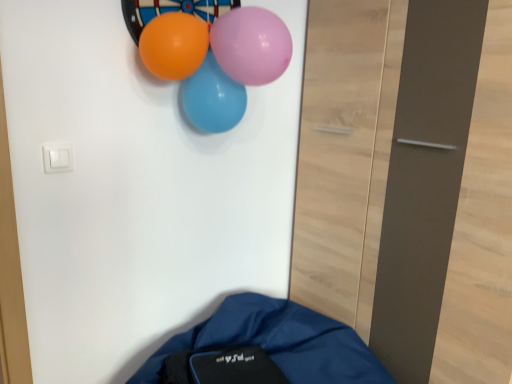
Describe the element at coordinates (251, 45) in the screenshot. I see `purple glossy balloon at upper center, which is the 3th balloon in back-to-front order` at that location.

Image resolution: width=512 pixels, height=384 pixels. I want to click on orange glossy balloon at upper center, arranged as the 2th balloon when viewed from the front, so click(174, 45).

From the picture: From a real-world perspective, relative to orange glossy balloon at upper center, the 2th balloon positioned from the back, is purple glossy balloon at upper center, which is the 3th balloon in back-to-front order, vertically above or below?

From a real-world perspective, purple glossy balloon at upper center, which is the 3th balloon in back-to-front order, is physically above orange glossy balloon at upper center, the 2th balloon positioned from the back.

The width and height of the screenshot is (512, 384). Find the location of `balloon above the orange glossy balloon at upper center, the 2th balloon positioned from the back (from the image's perspective)`. balloon above the orange glossy balloon at upper center, the 2th balloon positioned from the back (from the image's perspective) is located at coordinates (251, 45).

Considering the relative sizes of purple glossy balloon at upper center, which is the 3th balloon in back-to-front order, and orange glossy balloon at upper center, arranged as the 2th balloon when viewed from the front, in the image provided, is purple glossy balloon at upper center, which is the 3th balloon in back-to-front order, bigger than orange glossy balloon at upper center, arranged as the 2th balloon when viewed from the front,?

Correct, purple glossy balloon at upper center, which is the 3th balloon in back-to-front order, is larger in size than orange glossy balloon at upper center, arranged as the 2th balloon when viewed from the front.

From the image's perspective, would you say purple glossy balloon at upper center, placed as the first balloon when sorted from front to back, is shown under orange glossy balloon at upper center, the 2th balloon positioned from the back?

No, from the image's perspective, purple glossy balloon at upper center, placed as the first balloon when sorted from front to back, is not below orange glossy balloon at upper center, the 2th balloon positioned from the back.

Considering the sizes of objects purple glossy balloon at upper center, placed as the first balloon when sorted from front to back, and blue glossy balloon at upper center, arranged as the 1th balloon when viewed from the back, in the image provided, who is smaller, purple glossy balloon at upper center, placed as the first balloon when sorted from front to back, or blue glossy balloon at upper center, arranged as the 1th balloon when viewed from the back,?

purple glossy balloon at upper center, placed as the first balloon when sorted from front to back, is smaller.

Is point (233, 47) positioned after point (238, 102)?

No, (233, 47) is closer to viewer.

Is purple glossy balloon at upper center, which is the 3th balloon in back-to-front order, in front of blue glossy balloon at upper center, the third balloon from the front?

Yes, purple glossy balloon at upper center, which is the 3th balloon in back-to-front order, is closer to the viewer.

Is purple glossy balloon at upper center, placed as the first balloon when sorted from front to back, surrounding blue glossy balloon at upper center, the third balloon from the front?

No, blue glossy balloon at upper center, the third balloon from the front, is not a part of purple glossy balloon at upper center, placed as the first balloon when sorted from front to back.

Find the location of a particular element. balloon that is the 1st one when counting downward from the purple glossy balloon at upper center, which is the 3th balloon in back-to-front order (from the image's perspective) is located at coordinates (174, 45).

Is orange glossy balloon at upper center, the 2th balloon positioned from the back, facing away from purple glossy balloon at upper center, placed as the first balloon when sorted from front to back?

No.

From a real-world perspective, is orange glossy balloon at upper center, arranged as the 2th balloon when viewed from the front, above or below purple glossy balloon at upper center, placed as the first balloon when sorted from front to back?

Clearly, from a real-world perspective, orange glossy balloon at upper center, arranged as the 2th balloon when viewed from the front, is below purple glossy balloon at upper center, placed as the first balloon when sorted from front to back.

Which object is closer to the camera, orange glossy balloon at upper center, the 2th balloon positioned from the back, or purple glossy balloon at upper center, placed as the first balloon when sorted from front to back?

Positioned in front is purple glossy balloon at upper center, placed as the first balloon when sorted from front to back.

Is the depth of blue glossy balloon at upper center, the third balloon from the front, greater than that of orange glossy balloon at upper center, the 2th balloon positioned from the back?

Yes, it is behind orange glossy balloon at upper center, the 2th balloon positioned from the back.

At what (x,y) coordinates should I click in order to perform the action: click on the 1st balloon in front of the blue glossy balloon at upper center, the third balloon from the front. Please return your answer as a coordinate pair (x, y). This screenshot has width=512, height=384. Looking at the image, I should click on (174, 45).

Is blue glossy balloon at upper center, arranged as the 1th balloon when viewed from the back, to the left or to the right of orange glossy balloon at upper center, arranged as the 2th balloon when viewed from the front, in the image?

blue glossy balloon at upper center, arranged as the 1th balloon when viewed from the back, is to the right of orange glossy balloon at upper center, arranged as the 2th balloon when viewed from the front.

Are blue glossy balloon at upper center, the third balloon from the front, and orange glossy balloon at upper center, arranged as the 2th balloon when viewed from the front, far apart?

No, blue glossy balloon at upper center, the third balloon from the front, is in close proximity to orange glossy balloon at upper center, arranged as the 2th balloon when viewed from the front.

From a real-world perspective, is orange glossy balloon at upper center, the 2th balloon positioned from the back, below blue glossy balloon at upper center, arranged as the 1th balloon when viewed from the back?

No.

Between orange glossy balloon at upper center, arranged as the 2th balloon when viewed from the front, and blue glossy balloon at upper center, the third balloon from the front, which one has larger width?

Wider between the two is orange glossy balloon at upper center, arranged as the 2th balloon when viewed from the front.

What's the angular difference between orange glossy balloon at upper center, the 2th balloon positioned from the back, and blue glossy balloon at upper center, the third balloon from the front,'s facing directions?

The facing directions of orange glossy balloon at upper center, the 2th balloon positioned from the back, and blue glossy balloon at upper center, the third balloon from the front, are 0.000221 degrees apart.

Is orange glossy balloon at upper center, arranged as the 2th balloon when viewed from the front, outside of blue glossy balloon at upper center, the third balloon from the front?

Yes, orange glossy balloon at upper center, arranged as the 2th balloon when viewed from the front, is located beyond the bounds of blue glossy balloon at upper center, the third balloon from the front.

Does blue glossy balloon at upper center, the third balloon from the front, have a larger size compared to purple glossy balloon at upper center, placed as the first balloon when sorted from front to back?

Indeed, blue glossy balloon at upper center, the third balloon from the front, has a larger size compared to purple glossy balloon at upper center, placed as the first balloon when sorted from front to back.

Considering the positions of objects blue glossy balloon at upper center, the third balloon from the front, and purple glossy balloon at upper center, placed as the first balloon when sorted from front to back, in the image provided, who is in front, blue glossy balloon at upper center, the third balloon from the front, or purple glossy balloon at upper center, placed as the first balloon when sorted from front to back,?

purple glossy balloon at upper center, placed as the first balloon when sorted from front to back.

From the picture: Could you tell me if blue glossy balloon at upper center, the third balloon from the front, is facing purple glossy balloon at upper center, which is the 3th balloon in back-to-front order?

Yes, blue glossy balloon at upper center, the third balloon from the front, is turned towards purple glossy balloon at upper center, which is the 3th balloon in back-to-front order.

Does blue glossy balloon at upper center, the third balloon from the front, touch purple glossy balloon at upper center, which is the 3th balloon in back-to-front order?

blue glossy balloon at upper center, the third balloon from the front, is not next to purple glossy balloon at upper center, which is the 3th balloon in back-to-front order, and they're not touching.

Starting from the orange glossy balloon at upper center, the 2th balloon positioned from the back, which balloon is the 2nd one to the right? Please provide its 2D coordinates.

[(251, 45)]

Starting from the purple glossy balloon at upper center, placed as the first balloon when sorted from front to back, which balloon is the 2nd one behind? Please provide its 2D coordinates.

[(212, 98)]

Which object lies further to the anchor point blue glossy balloon at upper center, arranged as the 1th balloon when viewed from the back, orange glossy balloon at upper center, arranged as the 2th balloon when viewed from the front, or purple glossy balloon at upper center, placed as the first balloon when sorted from front to back?

Among the two, purple glossy balloon at upper center, placed as the first balloon when sorted from front to back, is located further to blue glossy balloon at upper center, arranged as the 1th balloon when viewed from the back.

In the scene shown: Looking at the image, which one is located further to purple glossy balloon at upper center, placed as the first balloon when sorted from front to back, blue glossy balloon at upper center, the third balloon from the front, or orange glossy balloon at upper center, the 2th balloon positioned from the back?

blue glossy balloon at upper center, the third balloon from the front, is further to purple glossy balloon at upper center, placed as the first balloon when sorted from front to back.

Consider the image. Estimate the real-world distances between objects in this image. Which object is further from orange glossy balloon at upper center, arranged as the 2th balloon when viewed from the front, purple glossy balloon at upper center, which is the 3th balloon in back-to-front order, or blue glossy balloon at upper center, the third balloon from the front?

purple glossy balloon at upper center, which is the 3th balloon in back-to-front order, is positioned further to the anchor orange glossy balloon at upper center, arranged as the 2th balloon when viewed from the front.

Looking at the image, which one is located further to purple glossy balloon at upper center, placed as the first balloon when sorted from front to back, orange glossy balloon at upper center, arranged as the 2th balloon when viewed from the front, or blue glossy balloon at upper center, the third balloon from the front?

Based on the image, blue glossy balloon at upper center, the third balloon from the front, appears to be further to purple glossy balloon at upper center, placed as the first balloon when sorted from front to back.

Which object lies further to the anchor point orange glossy balloon at upper center, the 2th balloon positioned from the back, blue glossy balloon at upper center, the third balloon from the front, or purple glossy balloon at upper center, which is the 3th balloon in back-to-front order?

The object further to orange glossy balloon at upper center, the 2th balloon positioned from the back, is purple glossy balloon at upper center, which is the 3th balloon in back-to-front order.

When comparing their distances from blue glossy balloon at upper center, the third balloon from the front, does purple glossy balloon at upper center, placed as the first balloon when sorted from front to back, or orange glossy balloon at upper center, the 2th balloon positioned from the back, seem further?

Among the two, purple glossy balloon at upper center, placed as the first balloon when sorted from front to back, is located further to blue glossy balloon at upper center, the third balloon from the front.

Identify the location of balloon between purple glossy balloon at upper center, which is the 3th balloon in back-to-front order, and blue glossy balloon at upper center, arranged as the 1th balloon when viewed from the back, from front to back. This screenshot has height=384, width=512. (174, 45).